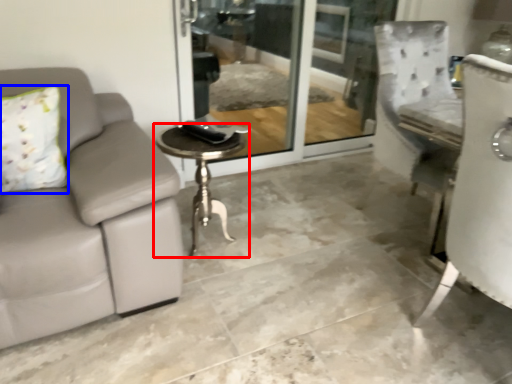
Question: Among these objects, which one is nearest to the camera, table (highlighted by a red box) or pillow (highlighted by a blue box)?

Choices:
 (A) table
 (B) pillow

Answer: (B)